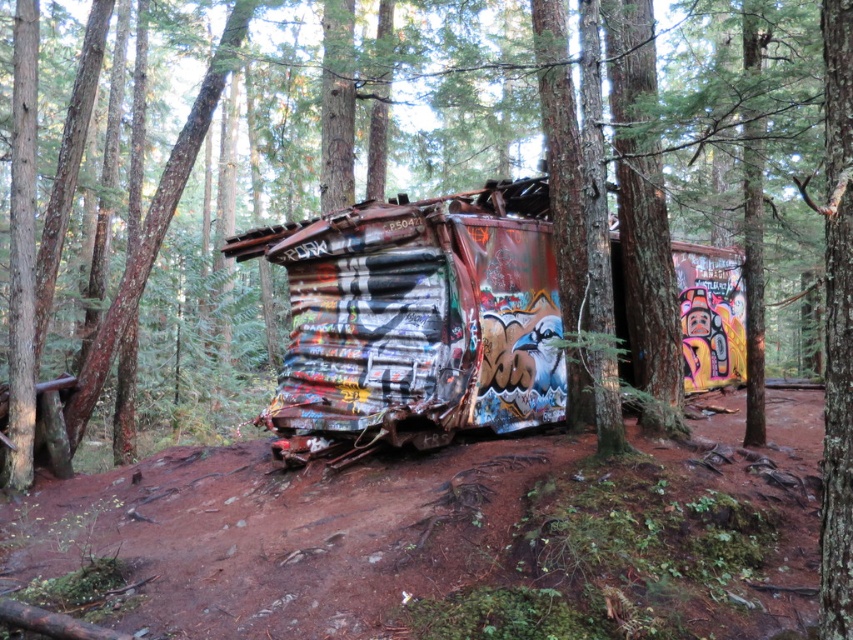
Question: Observing the image, what is the correct spatial positioning of brown dirt track at center in reference to rusty corrugated metal train car at center?

Choices:
 (A) above
 (B) below

Answer: (B)

Question: Can you confirm if brown dirt track at center is smaller than rusty corrugated metal train car at center?

Choices:
 (A) no
 (B) yes

Answer: (B)

Question: Is brown dirt track at center positioned before rusty corrugated metal train car at center?

Choices:
 (A) yes
 (B) no

Answer: (A)

Question: Which point is closer to the camera taking this photo?

Choices:
 (A) (480, 266)
 (B) (720, 598)

Answer: (B)